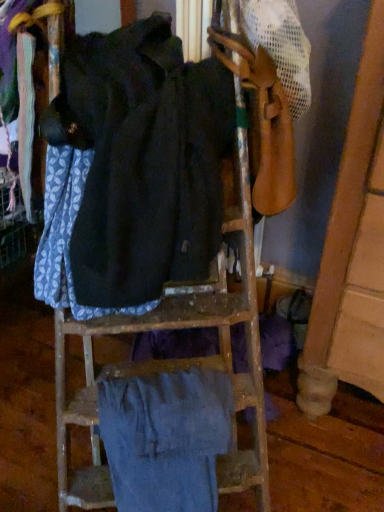
Question: In terms of size, does dark blue fabric at center, the first wide positioned from the top, appear bigger or smaller than denim pants at lower center, which ranks as the 2th wide in top-to-bottom order?

Choices:
 (A) big
 (B) small

Answer: (A)

Question: Is point click(139, 96) positioned closer to the camera than point click(112, 417)?

Choices:
 (A) closer
 (B) farther

Answer: (A)

Question: From the image's perspective, relative to denim pants at lower center, placed as the first wide when sorted from bottom to top, is dark blue fabric at center, which is the 2th wide in bottom-to-top order, above or below?

Choices:
 (A) above
 (B) below

Answer: (A)

Question: From their relative heights in the image, would you say denim pants at lower center, which ranks as the 2th wide in top-to-bottom order, is taller or shorter than dark blue fabric at center, the first wide positioned from the top?

Choices:
 (A) tall
 (B) short

Answer: (B)

Question: From the image's perspective, is denim pants at lower center, placed as the first wide when sorted from bottom to top, positioned above or below dark blue fabric at center, the first wide positioned from the top?

Choices:
 (A) below
 (B) above

Answer: (A)

Question: In the image, is denim pants at lower center, which ranks as the 2th wide in top-to-bottom order, on the left side or the right side of dark blue fabric at center, the first wide positioned from the top?

Choices:
 (A) left
 (B) right

Answer: (B)

Question: Is point (145, 478) positioned closer to the camera than point (129, 281)?

Choices:
 (A) closer
 (B) farther

Answer: (B)